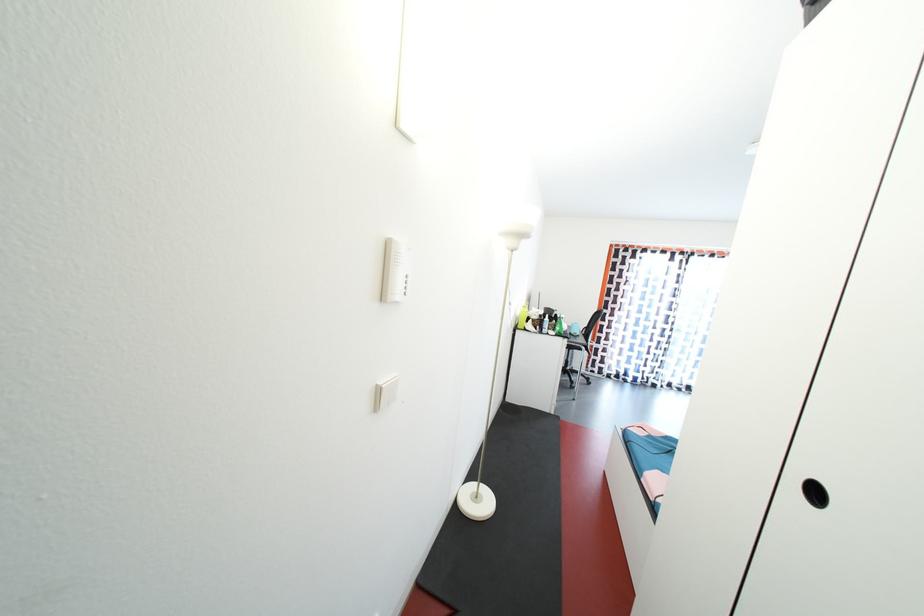
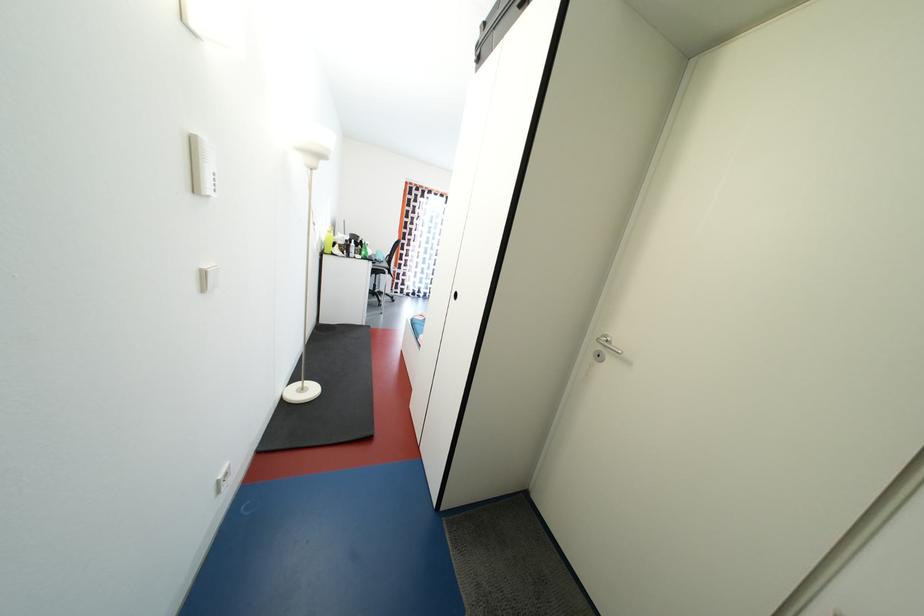
Question: Based on the continuous images, in which direction is the camera rotating? Reply with the corresponding letter.

Choices:
 (A) Left
 (B) Right
 (C) Up
 (D) Down

Answer: (B)